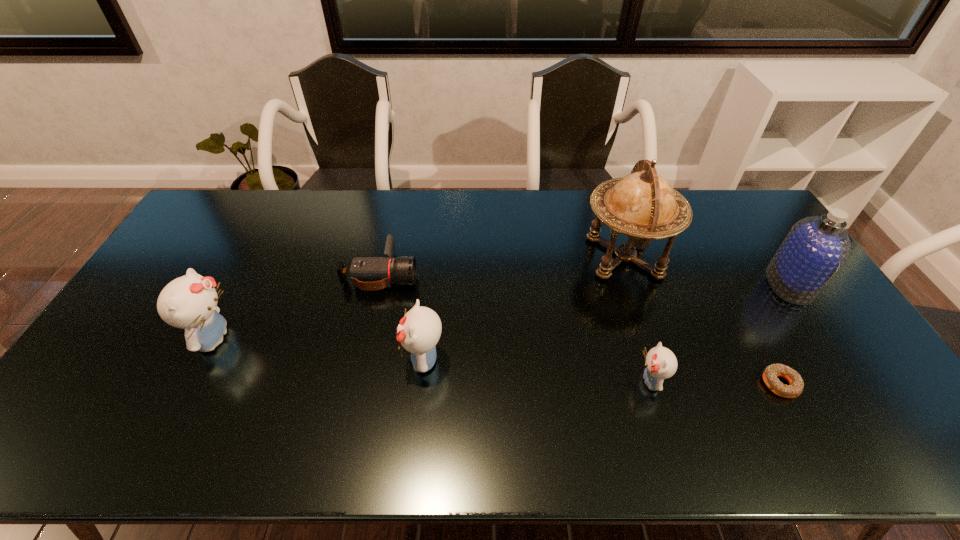
Identify the location of free region located on the front-facing side of the globe. (556, 258).

Image resolution: width=960 pixels, height=540 pixels. I want to click on vacant area situated on the front of the second tallest object, so click(830, 346).

This screenshot has height=540, width=960. What are the coordinates of `free space located on the lens of the camcorder` in the screenshot? It's located at [458, 273].

Find the location of a particular element. This screenshot has width=960, height=540. vacant space located on the back of the second object from right to left is located at coordinates (758, 343).

Find the location of a particular element. object at the far edge is located at coordinates (642, 205).

Identify the location of doughnut at the near edge. Image resolution: width=960 pixels, height=540 pixels. tap(770, 374).

Identify the location of object located at the right edge. (816, 247).

Locate an element on the screen. This screenshot has width=960, height=540. vacant area at the far edge of the desktop is located at coordinates (337, 199).

Where is `blank area at the near edge`? This screenshot has height=540, width=960. blank area at the near edge is located at coordinates (238, 406).

This screenshot has height=540, width=960. I want to click on vacant space at the left edge of the desktop, so click(181, 259).